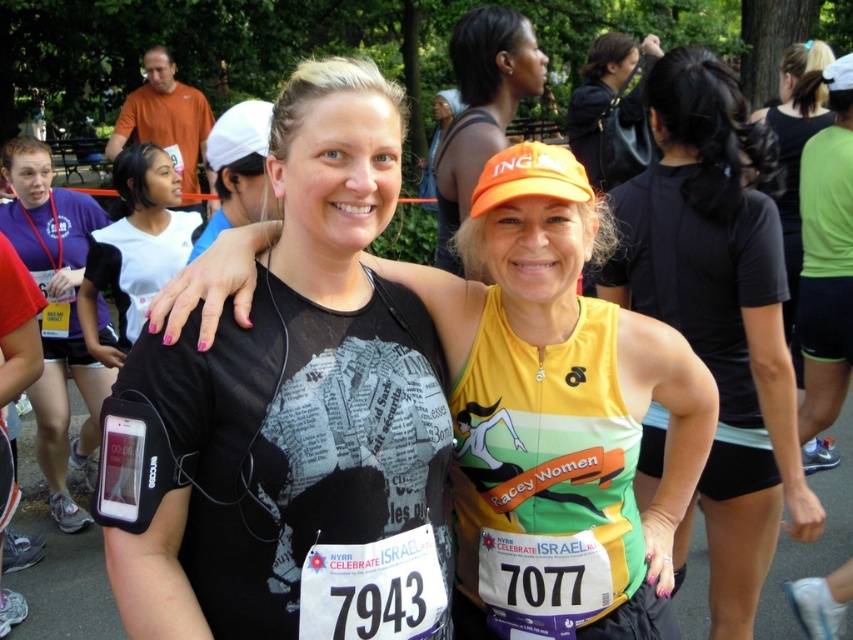
You are a participant in the race and you see two points marked in the image. The first point is at coordinates point [375,420] and the second point is at point [1,168]. Which point is closer to your current position if you are standing at the starting line?

Point [375,420] is in front of point [1,168], so if you are at the starting line, point [375,420] is closer to you.